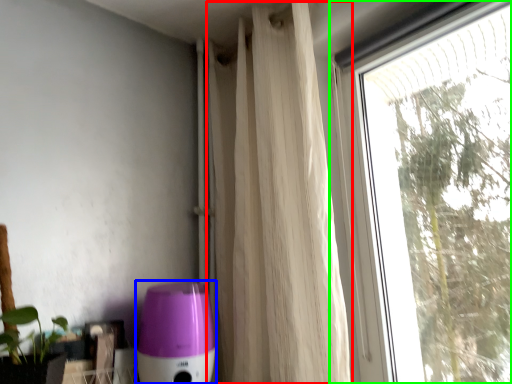
Question: Which object is positioned closest to curtain (highlighted by a red box)? Select from appliance (highlighted by a blue box) and window (highlighted by a green box).

Choices:
 (A) appliance
 (B) window

Answer: (A)